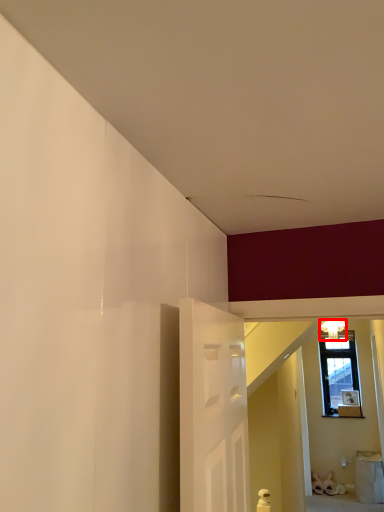
Question: From the image's perspective, where is light fixture (annotated by the red box) located relative to furniture?

Choices:
 (A) below
 (B) above

Answer: (B)